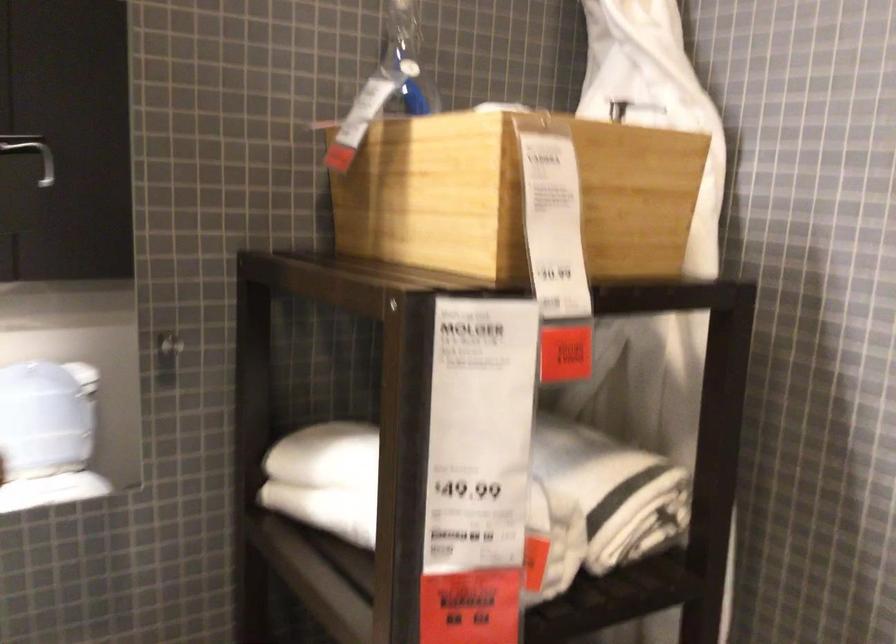
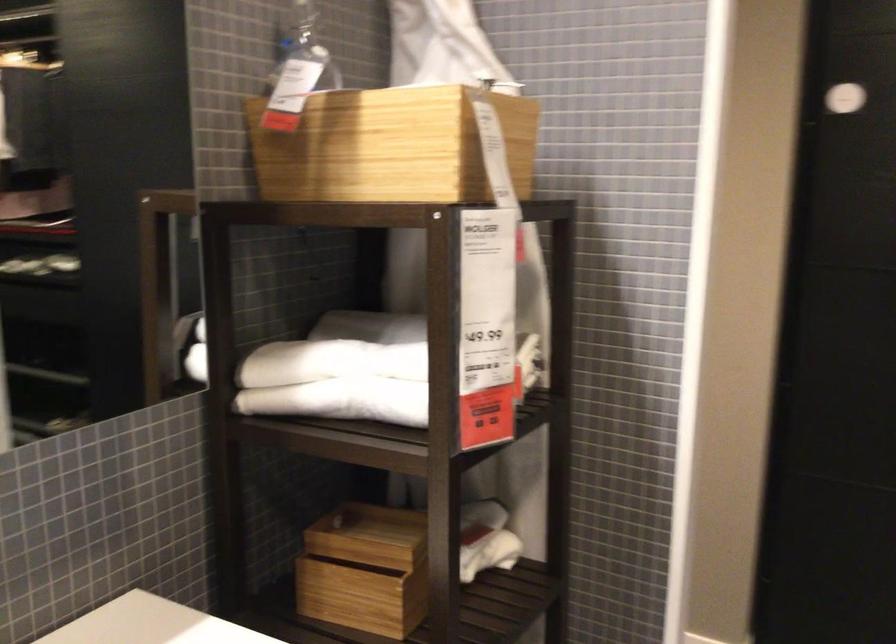
Where in the second image is the point corresponding to the point at 437,193 from the first image?

(390, 147)